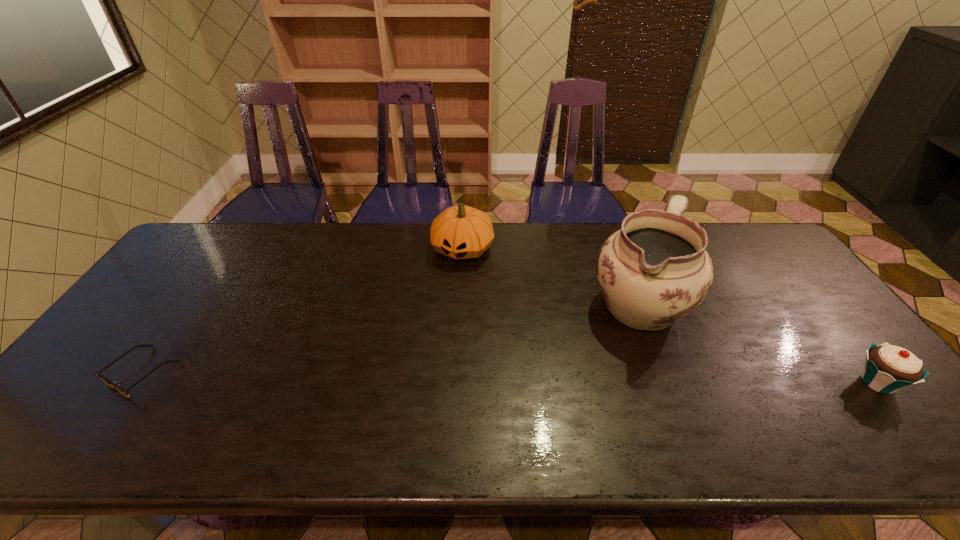
At what (x,y) coordinates should I click in order to perform the action: click on free spot between the sunglasses and the pitcher. Please return your answer as a coordinate pair (x, y). The width and height of the screenshot is (960, 540). Looking at the image, I should click on (391, 338).

The height and width of the screenshot is (540, 960). What are the coordinates of `free space between the sunglasses and the cupcake` in the screenshot? It's located at (510, 377).

This screenshot has height=540, width=960. I want to click on free space that is in between the pitcher and the gourd, so click(550, 276).

At what (x,y) coordinates should I click in order to perform the action: click on unoccupied area between the tallest object and the cupcake. Please return your answer as a coordinate pair (x, y). Looking at the image, I should click on (757, 343).

You are a GUI agent. You are given a task and a screenshot of the screen. Output one action in this format:
    pyautogui.click(x=<x>, y=<y>)
    Task: Click on the vacant region between the sunglasses and the rightmost object
    
    Given the screenshot: What is the action you would take?
    pyautogui.click(x=510, y=377)

You are a GUI agent. You are given a task and a screenshot of the screen. Output one action in this format:
    pyautogui.click(x=<x>, y=<y>)
    Task: Click on the free space that is in between the pitcher and the rightmost object
    This screenshot has width=960, height=540.
    Given the screenshot: What is the action you would take?
    pyautogui.click(x=757, y=343)

At what (x,y) coordinates should I click in order to perform the action: click on vacant area that lies between the cupcake and the sunglasses. Please return your answer as a coordinate pair (x, y). This screenshot has width=960, height=540. Looking at the image, I should click on (510, 377).

The image size is (960, 540). Find the location of `the third closest object to the leftmost object`. the third closest object to the leftmost object is located at coordinates (888, 368).

Locate which object is the third closest to the tallest object. Please provide its 2D coordinates. Your answer should be formatted as a tuple, i.e. [(x, y)], where the tuple contains the x and y coordinates of a point satisfying the conditions above.

[(109, 382)]

This screenshot has width=960, height=540. In order to click on free location that satisfies the following two spatial constraints: 1. on the lenses of the cupcake; 2. on the left side of the leftmost object in this screenshot , I will do `click(135, 382)`.